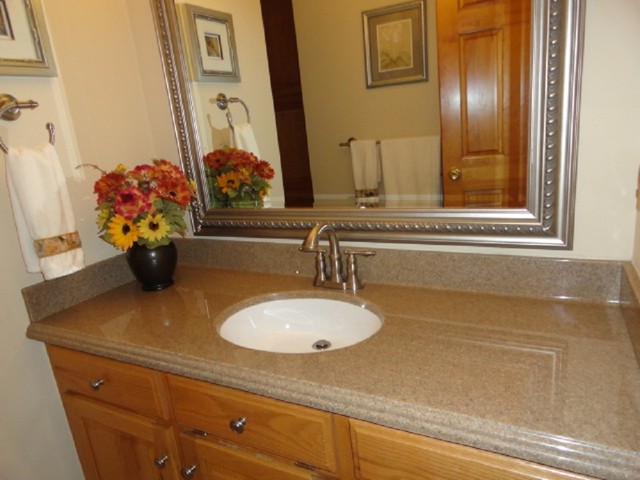
The image size is (640, 480). What are the coordinates of `reflection of towels` in the screenshot? It's located at (413, 164), (365, 160), (248, 134).